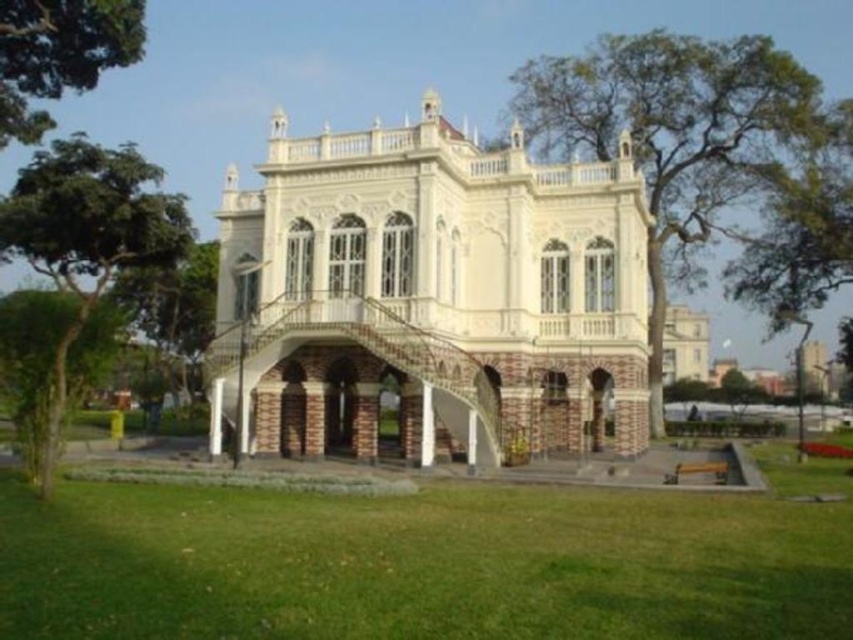
Question: Is green leafy tree at left below green leafy tree at upper left?

Choices:
 (A) yes
 (B) no

Answer: (A)

Question: Does white brick palace at center have a lesser width compared to green leafy tree at left?

Choices:
 (A) yes
 (B) no

Answer: (A)

Question: Among these objects, which one is nearest to the camera?

Choices:
 (A) green leafy tree at upper center
 (B) green leafy tree at left

Answer: (B)

Question: Can you confirm if white brick palace at center is positioned to the right of green leafy tree at upper left?

Choices:
 (A) no
 (B) yes

Answer: (B)

Question: Which of the following is the closest to the observer?

Choices:
 (A) green leafy tree at upper center
 (B) green grass at lower center

Answer: (B)

Question: Which object is farther from the camera taking this photo?

Choices:
 (A) green grass at lower center
 (B) green leafy tree at upper left
 (C) white brick palace at center

Answer: (B)